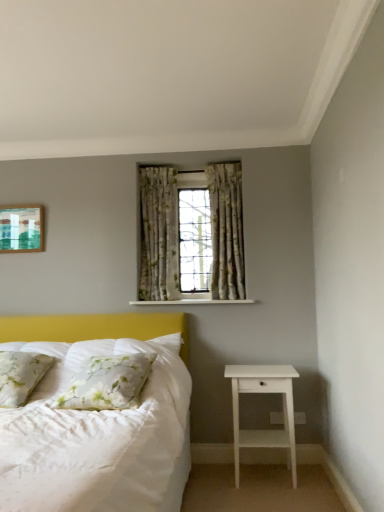
Question: Is white floral pillow at lower left, which is counted as the 2th pillow, starting from the left, further to the viewer compared to floral fabric curtains at center?

Choices:
 (A) no
 (B) yes

Answer: (A)

Question: Is white floral pillow at lower left, acting as the 1th pillow starting from the right, located outside floral fabric curtains at center?

Choices:
 (A) yes
 (B) no

Answer: (A)

Question: Is white floral pillow at lower left, which is counted as the 2th pillow, starting from the left, oriented away from floral fabric curtains at center?

Choices:
 (A) yes
 (B) no

Answer: (B)

Question: Is floral fabric curtains at center surrounded by white floral pillow at lower left, which is counted as the 2th pillow, starting from the left?

Choices:
 (A) yes
 (B) no

Answer: (B)

Question: From the image's perspective, is white floral pillow at lower left, which is counted as the 2th pillow, starting from the left, on floral fabric curtains at center?

Choices:
 (A) no
 (B) yes

Answer: (A)

Question: Is white floral pillow at lower left, acting as the 1th pillow starting from the right, directly adjacent to floral fabric curtains at center?

Choices:
 (A) yes
 (B) no

Answer: (B)

Question: From a real-world perspective, is white matte nightstand at lower right beneath floral fabric pillow at left, the 1th pillow in the left-to-right sequence?

Choices:
 (A) no
 (B) yes

Answer: (B)

Question: From a real-world perspective, is white matte nightstand at lower right positioned over floral fabric pillow at left, the 1th pillow in the left-to-right sequence, based on gravity?

Choices:
 (A) no
 (B) yes

Answer: (A)

Question: Is floral fabric pillow at left, the 1th pillow in the left-to-right sequence, surrounded by white matte nightstand at lower right?

Choices:
 (A) no
 (B) yes

Answer: (A)

Question: From the image's perspective, is white matte nightstand at lower right on floral fabric pillow at left, the second pillow when ordered from right to left?

Choices:
 (A) no
 (B) yes

Answer: (A)

Question: Is white matte nightstand at lower right not near floral fabric pillow at left, the second pillow when ordered from right to left?

Choices:
 (A) no
 (B) yes

Answer: (B)

Question: Does white matte nightstand at lower right have a greater width compared to floral fabric pillow at left, the second pillow when ordered from right to left?

Choices:
 (A) yes
 (B) no

Answer: (B)

Question: Can you confirm if white matte nightstand at lower right is taller than green floral fabric curtain at center, which is the 1th curtain in left-to-right order?

Choices:
 (A) yes
 (B) no

Answer: (B)